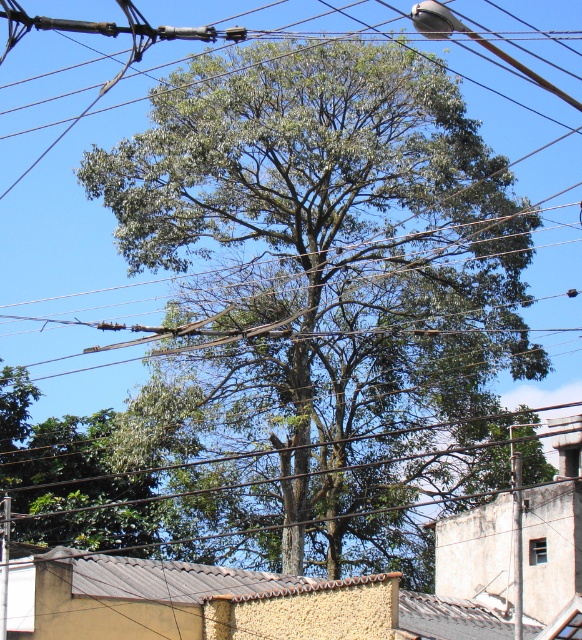
You are standing in front of the large tree and looking at two points marked in the image. The first point is at coordinates point [214,410] and the second is at point [8,573]. Which point is closer to you?

Point [8,573] is closer to you because it is less further to the camera than point [214,410].

You are a bird planning to fly from the green leafy tree at center to the metallic gray telegraph pole at center. Given that your maximum flight distance is 100 feet, can you make this journey without stopping?

The green leafy tree at center is 110.89 feet away from metallic gray telegraph pole at center. Since your maximum flight distance is 100 feet, you cannot make this journey without stopping as the distance exceeds your capability.